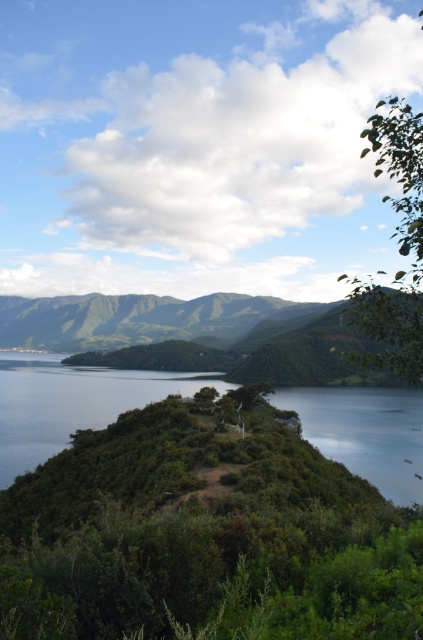
Question: Can you confirm if green leafy shrubs at center is smaller than green leafy mountain at center?

Choices:
 (A) yes
 (B) no

Answer: (A)

Question: Among these objects, which one is nearest to the camera?

Choices:
 (A) green leafy mountain at center
 (B) green leafy shrubs at center

Answer: (B)

Question: Does green leafy shrubs at center have a larger size compared to green leafy mountain at center?

Choices:
 (A) no
 (B) yes

Answer: (A)

Question: Among these points, which one is nearest to the camera?

Choices:
 (A) (293, 301)
 (B) (85, 570)

Answer: (B)

Question: Which point appears closest to the camera in this image?

Choices:
 (A) [176, 307]
 (B) [346, 579]

Answer: (B)

Question: Can you confirm if green leafy shrubs at center is positioned to the left of green leafy mountain at center?

Choices:
 (A) yes
 (B) no

Answer: (B)